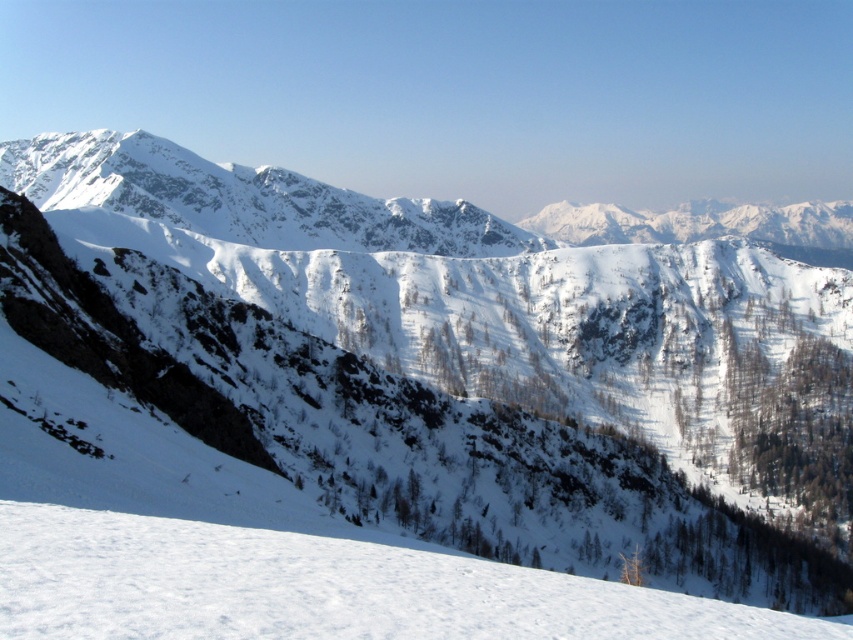
You are a hiker planning to traverse the snowy area in the image. You see a point marked at coordinates point (318, 588). What is the terrain like at that location?

The point marked at coordinates point (318, 588) is white snow at lower center, so the terrain there is snowy and likely flat or gently sloping, making it suitable for walking.